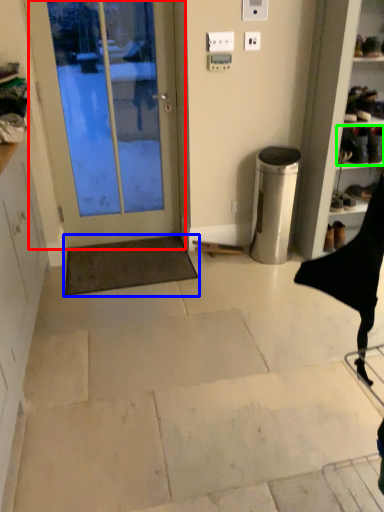
Question: Considering the real-world distances, which object is farthest from door (highlighted by a red box)? doormat (highlighted by a blue box) or footwear (highlighted by a green box)?

Choices:
 (A) doormat
 (B) footwear

Answer: (B)